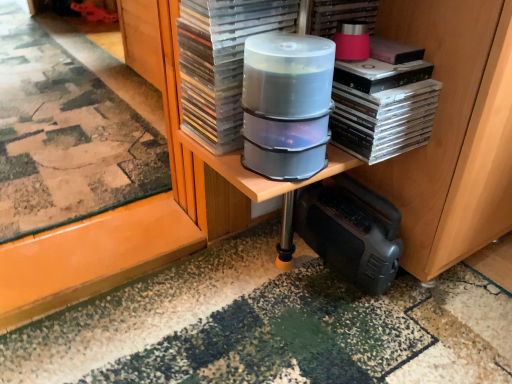
Locate an element on the screen. vacant point to the right of black plastic speaker at lower right, acting as the 1th appliance starting from the back is located at coordinates (450, 298).